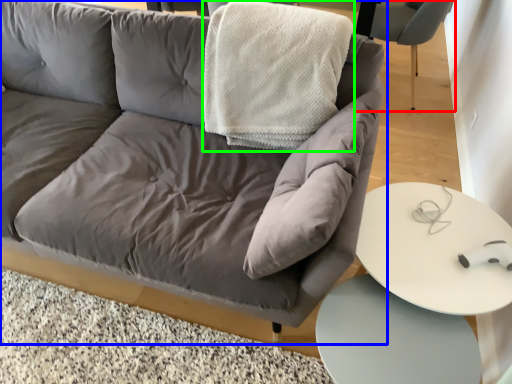
Question: Which object is the closest to the chair (highlighted by a red box)? Choose among these: studio couch (highlighted by a blue box) or blanket (highlighted by a green box).

Choices:
 (A) studio couch
 (B) blanket

Answer: (B)